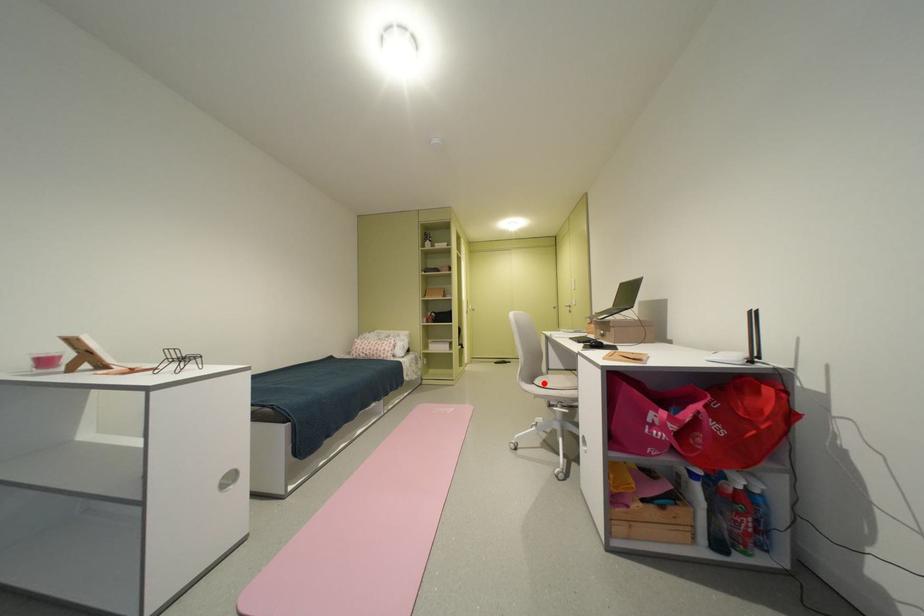
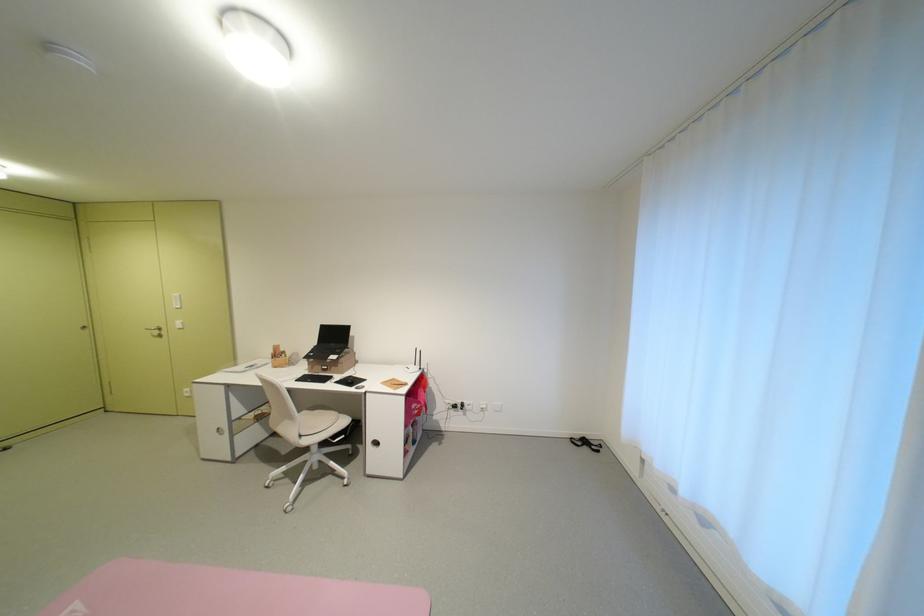
Question: I am providing you with two images of the same scene from different viewpoints. In image1, a red point is highlighted. Considering the same 3D point in image2, which of the following is correct?

Choices:
 (A) It is closer
 (B) It is farther

Answer: (A)